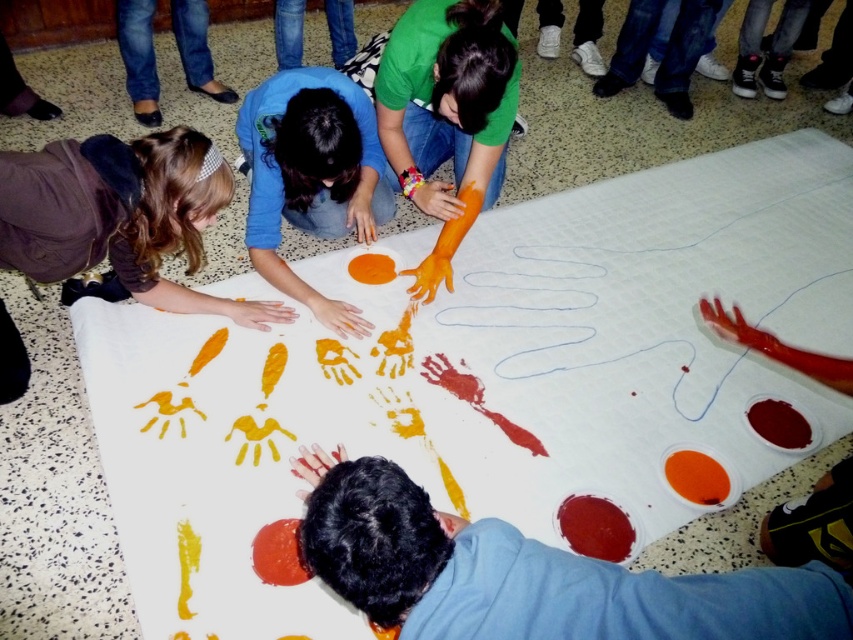
Question: Which point is closer to the camera?

Choices:
 (A) matte orange handprint at center
 (B) brown fuzzy jacket at lower left

Answer: (B)

Question: Which object appears farthest from the camera in this image?

Choices:
 (A) matte orange handprint at center
 (B) brown fuzzy jacket at lower left

Answer: (A)

Question: Is brown fuzzy jacket at lower left to the right of matte orange handprint at center from the viewer's perspective?

Choices:
 (A) no
 (B) yes

Answer: (A)

Question: Is brown fuzzy jacket at lower left to the left of matte orange handprint at center from the viewer's perspective?

Choices:
 (A) yes
 (B) no

Answer: (A)

Question: Does brown fuzzy jacket at lower left have a greater width compared to matte orange handprint at center?

Choices:
 (A) yes
 (B) no

Answer: (A)